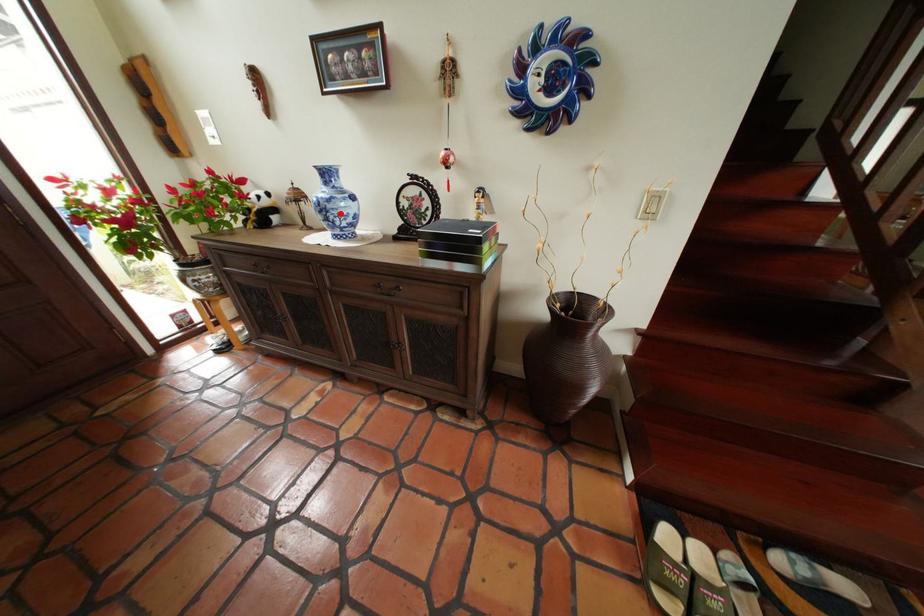
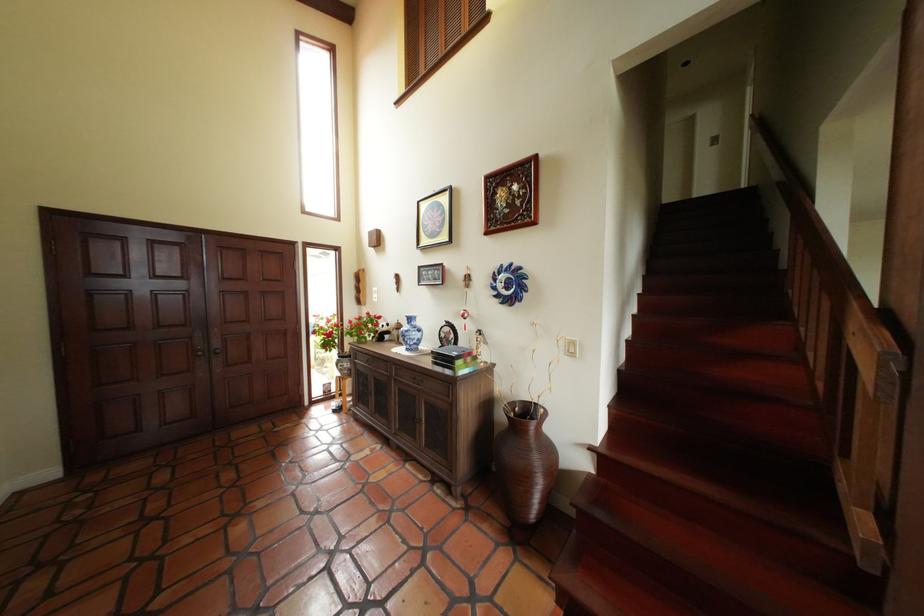
Question: I am providing you with two images of the same scene from different viewpoints. A red point is shown in image1. For the corresponding object point in image2, is it positioned nearer or farther from the camera?

Choices:
 (A) Nearer
 (B) Farther

Answer: (B)